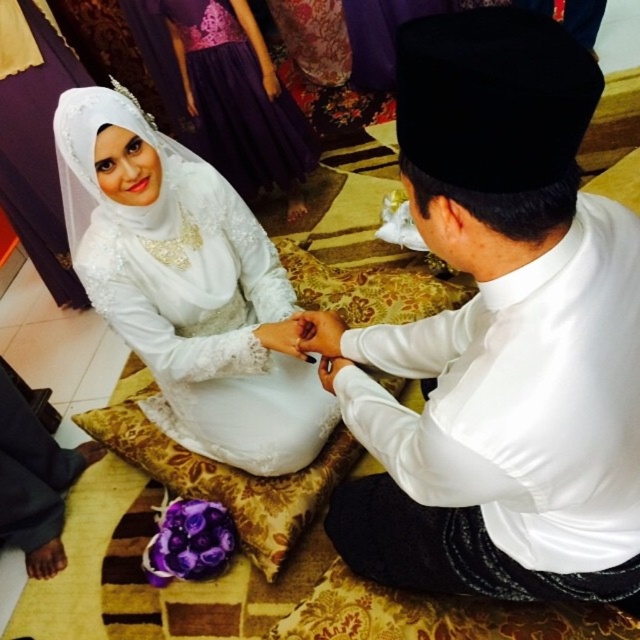
You are a tailor who needs to ensure the white satin shirt at center fits properly. The customer mentioned they also want the white satin hand at center to be part of the outfit. Which item requires more horizontal space when worn?

The white satin shirt at center requires more horizontal space when worn because its width is larger than the white satin hand at center.

You are a photographer standing at point (500, 336) in the wedding scene. What object is located exactly at your current position?

The white satin shirt at center is located exactly at point (500, 336).

You are a photographer at a wedding and need to ensure that both the white satin shirt at center and the white satin hand at center are clearly visible in the photo. Given their sizes, which one should you focus on to ensure both are in frame without cropping?

The white satin shirt at center is larger in size than the white satin hand at center, so you should focus on the white satin shirt at center to ensure both are in frame without cropping.